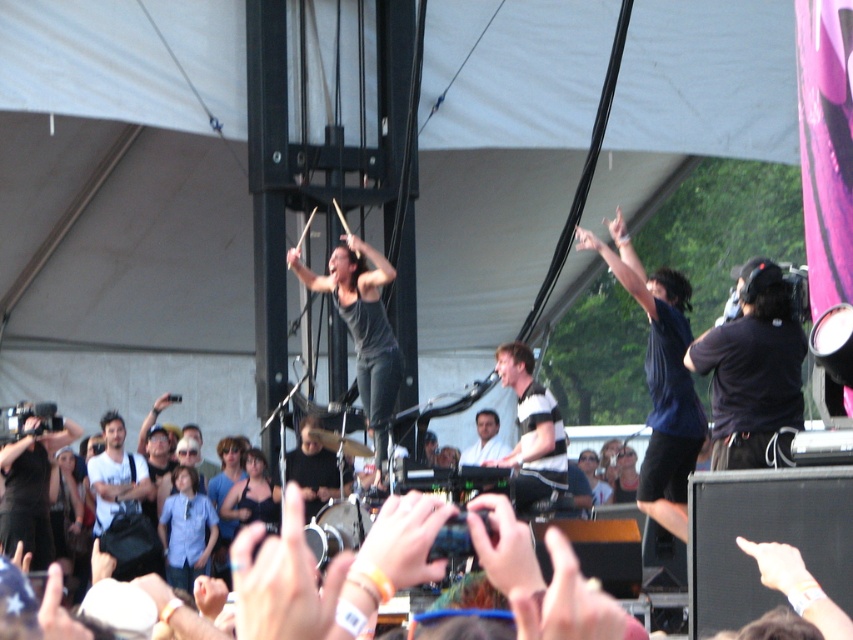
Is matte black hand at center smaller than smooth skin hand at upper center?

Correct, matte black hand at center occupies less space than smooth skin hand at upper center.

Based on the photo, how much distance is there between matte black hand at center and smooth skin hand at upper center?

matte black hand at center and smooth skin hand at upper center are 12.02 meters apart from each other.

Image resolution: width=853 pixels, height=640 pixels. I want to click on matte black hand at center, so pos(404,540).

In the scene shown: Does striped cotton shirt at center have a larger size compared to matte black hand at center?

No.

Between point (515, 342) and point (416, 524), which one is positioned behind?

Positioned behind is point (515, 342).

Where is `striped cotton shirt at center`? striped cotton shirt at center is located at coordinates (531, 429).

Identify the location of striped cotton shirt at center. The width and height of the screenshot is (853, 640). (531, 429).

Between white matte shirt at center and smooth white shirt at center, which one has less height?

Standing shorter between the two is smooth white shirt at center.

Does white matte shirt at center have a greater width compared to smooth white shirt at center?

Indeed, white matte shirt at center has a greater width compared to smooth white shirt at center.

Does point (126, 492) come in front of point (497, 419)?

Yes, point (126, 492) is in front of point (497, 419).

In order to click on white matte shirt at center in this screenshot , I will do `click(115, 474)`.